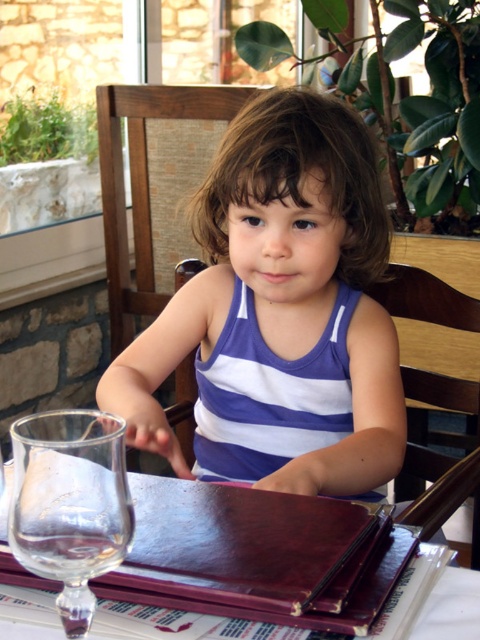
You are a photographer trying to capture the purple striped tank top at center in the image. The camera you are using has a fixed focus that can only clearly capture objects within a 0.1 unit radius around the point specified by the coordinates. Given that the point provided is at coordinates point (284, 285), will the camera be able to focus on the purple striped tank top at center?

The point (284, 285) corresponds to the purple striped tank top at center, so yes, the camera will be able to focus on the purple striped tank top at center since the focus point is exactly at the location of the object.

You are a photographer trying to capture a closeup of the menu or book with a dark cover on the table. You notice two points on the table marked as point 1 at coordinates point (276, 468) and point 2 at coordinates point (12, 561). Which point should you focus on to ensure the menu or book is in focus?

Point 1 at coordinates point (276, 468) is further to the camera than point 2 at coordinates point (12, 561), so focusing on point 1 will ensure the menu or book is in focus.

You are a waiter in a restaurant. You need to place a new drink order for the child. The drink will be served in a cup that is the same size as the brown leather menu at center. Can the transparent glass at lower left hold the drink?

The transparent glass at lower left is smaller than the brown leather menu at center. Since the drink cup is the same size as the menu, the glass cannot hold the drink because it is smaller.